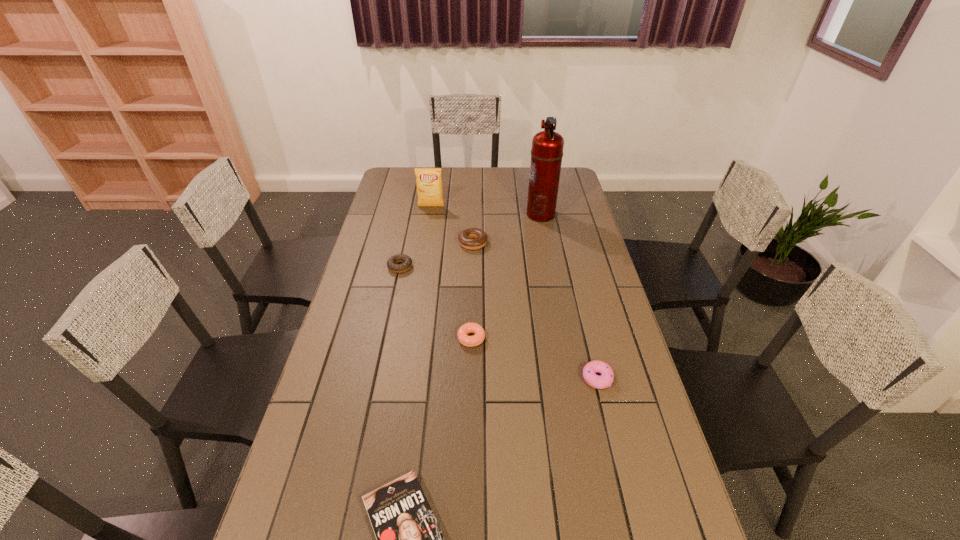
Select which object appears as the third closest to the farthest doughnut. Please provide its 2D coordinates. Your answer should be formatted as a tuple, i.e. [(x, y)], where the tuple contains the x and y coordinates of a point satisfying the conditions above.

[(429, 180)]

Choose which doughnut is the fourth nearest neighbor to the fire extinguisher. Please provide its 2D coordinates. Your answer should be formatted as a tuple, i.e. [(x, y)], where the tuple contains the x and y coordinates of a point satisfying the conditions above.

[(605, 380)]

Where is `doughnut that is the closest to the leftmost doughnut`? This screenshot has width=960, height=540. doughnut that is the closest to the leftmost doughnut is located at coordinates (473, 238).

Identify the location of free spot that satisfies the following two spatial constraints: 1. on the front of the second nearest object with the logo; 2. on the right side of the crisp (potato chip). This screenshot has width=960, height=540. (404, 379).